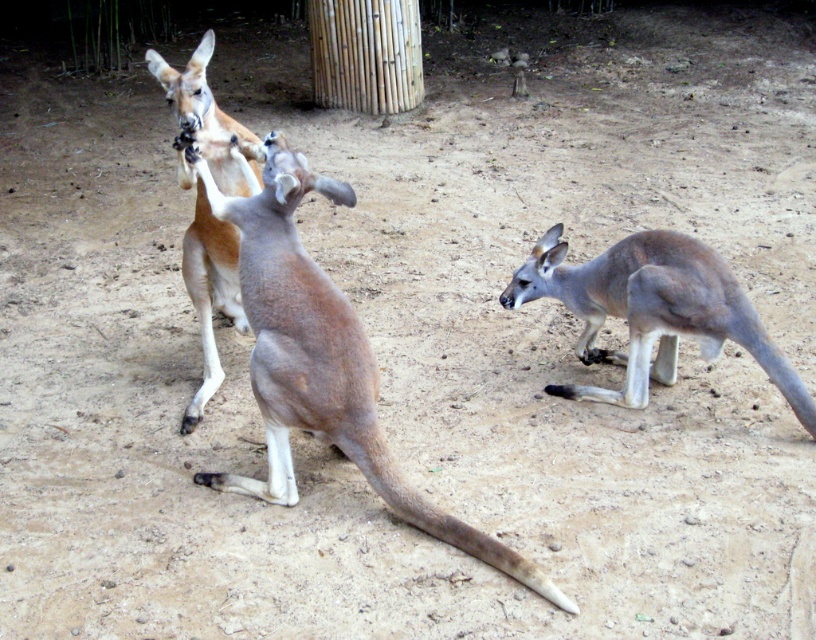
Question: Is light brown fur kangaroo at center wider than brown fur kangaroo at center?

Choices:
 (A) yes
 (B) no

Answer: (A)

Question: Which of these objects is positioned farthest from the brown fur kangaroo at center?

Choices:
 (A) light brown fur kangaroo at center
 (B) grayish-brown fur at right

Answer: (B)

Question: Which object is positioned farthest from the light brown fur kangaroo at center?

Choices:
 (A) brown fur kangaroo at center
 (B) grayish-brown fur at right

Answer: (B)

Question: Where is light brown fur kangaroo at center located in relation to brown fur kangaroo at center in the image?

Choices:
 (A) above
 (B) below

Answer: (B)

Question: Which point is farther to the camera?

Choices:
 (A) light brown fur kangaroo at center
 (B) brown fur kangaroo at center

Answer: (B)

Question: Is light brown fur kangaroo at center to the right of brown fur kangaroo at center from the viewer's perspective?

Choices:
 (A) no
 (B) yes

Answer: (B)